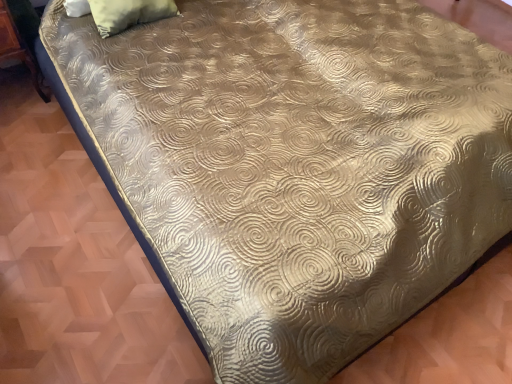
Describe the element at coordinates (20, 37) in the screenshot. The image size is (512, 384). I see `wooden dresser at left` at that location.

What is the approximate width of wooden dresser at left?

It is 28.95 centimeters.

Identify the location of wooden dresser at left. This screenshot has width=512, height=384. (20, 37).

At what (x,y) coordinates should I click in order to perform the action: click on wooden dresser at left. Please return your answer as a coordinate pair (x, y). Image resolution: width=512 pixels, height=384 pixels. Looking at the image, I should click on (20, 37).